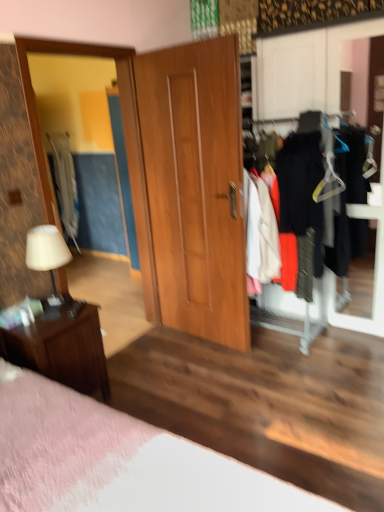
This screenshot has height=512, width=384. I want to click on free space in front of matte black clothes at right, so click(x=334, y=360).